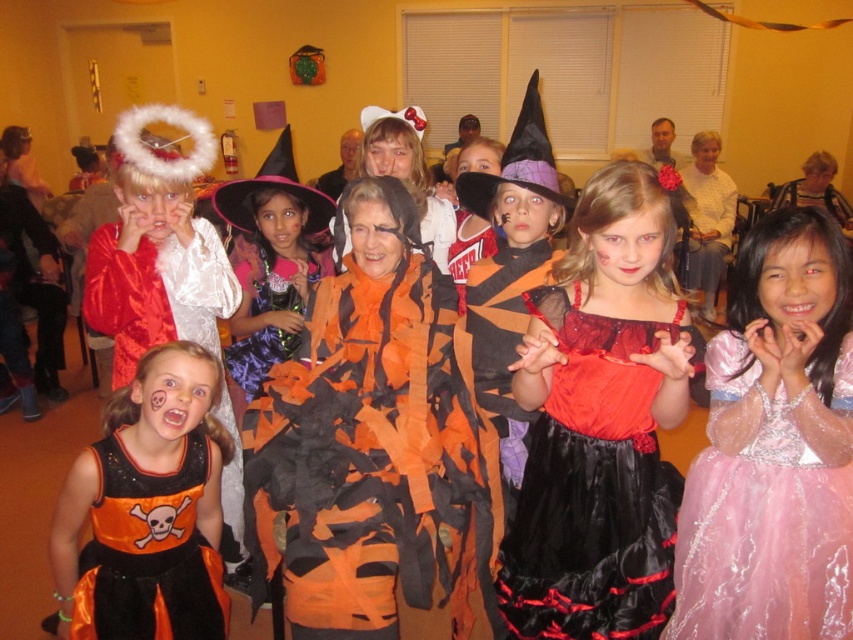
At what (x,y) coordinates should I click in order to perform the action: click on shiny satin dress at center. Please return your answer as a coordinate pair (x, y). This screenshot has width=853, height=640. Looking at the image, I should click on pos(593,484).

Identify the location of shiny satin dress at center. Image resolution: width=853 pixels, height=640 pixels. (593, 484).

Is orange satin dress at center above pink felt witch hat at center?

No, orange satin dress at center is not above pink felt witch hat at center.

Between orange satin dress at center and pink felt witch hat at center, which one is positioned higher?

pink felt witch hat at center is higher up.

Does point (242, 348) come behind point (329, 214)?

No, it is not.

This screenshot has height=640, width=853. I want to click on orange satin dress at center, so click(x=258, y=355).

Does shiny silver halo at upper left have a lesser height compared to orange satin dress at center?

No.

Who is positioned more to the right, shiny silver halo at upper left or orange satin dress at center?

orange satin dress at center

Who is more distant from viewer, (132,260) or (271,346)?

Positioned behind is point (271,346).

Locate an element on the screen. The image size is (853, 640). shiny silver halo at upper left is located at coordinates 157,246.